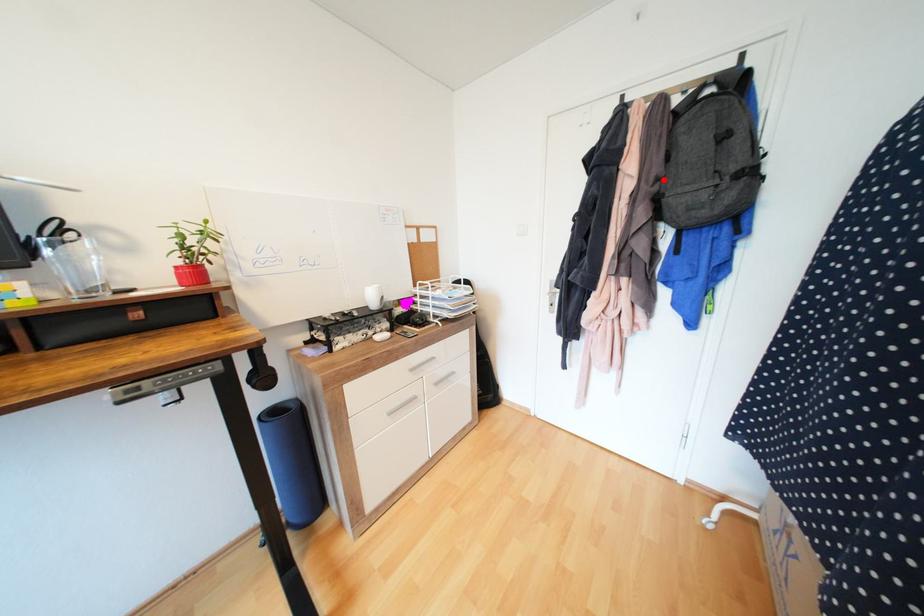
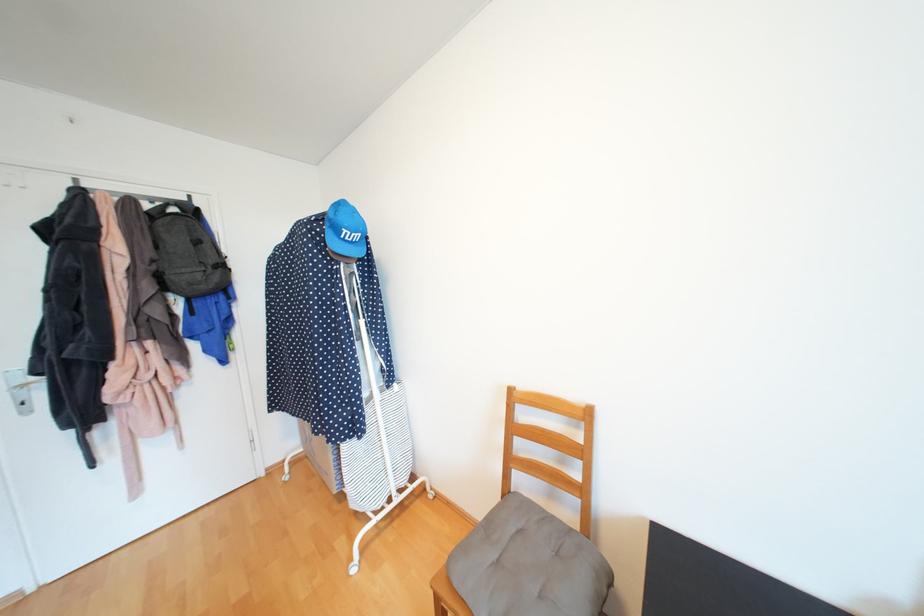
Locate, in the second image, the point that corresponds to the highlighted location in the first image.

(160, 262)